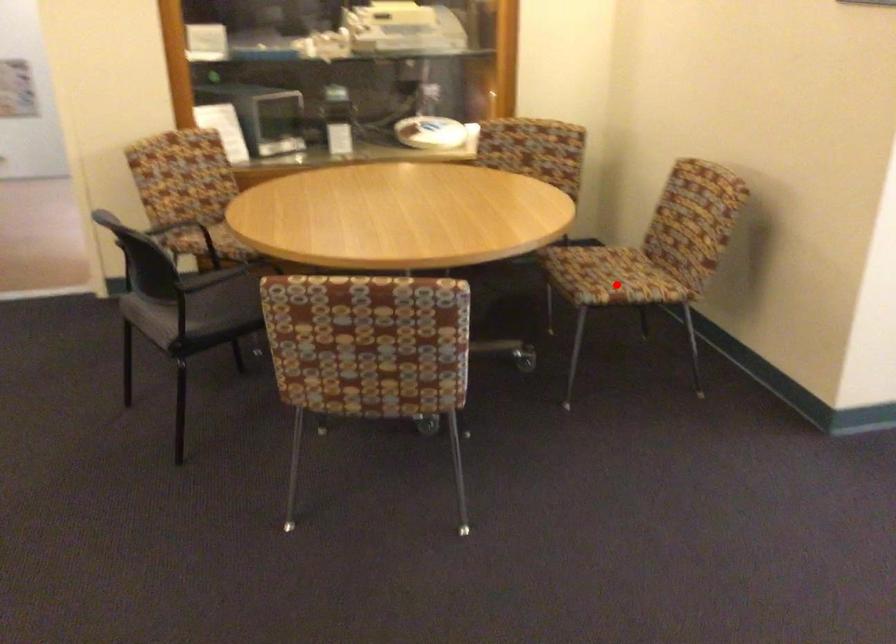
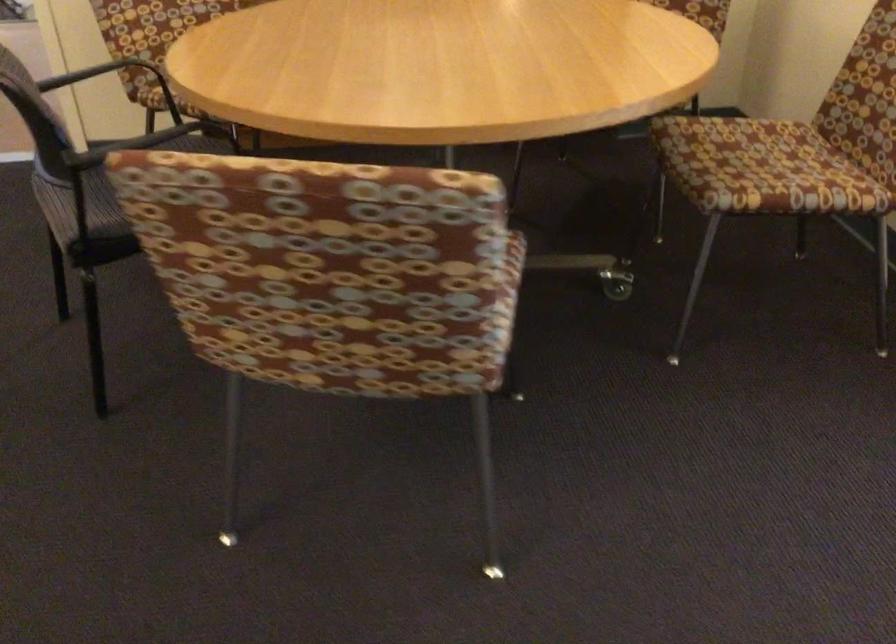
Question: A red point is marked in image1. In image2, is the corresponding 3D point closer to the camera or farther? Reply with the corresponding letter.

Choices:
 (A) The corresponding 3D point is closer.
 (B) The corresponding 3D point is farther.

Answer: (A)